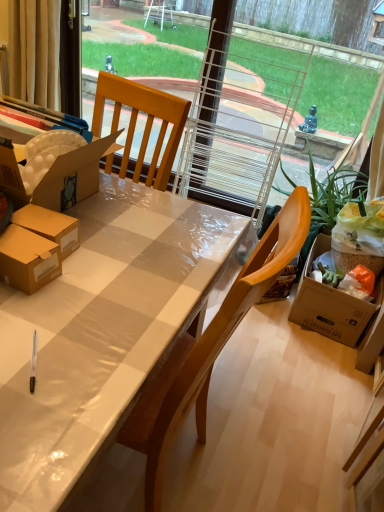
Locate an element on the screen. matte plastic desk at center is located at coordinates (101, 332).

The width and height of the screenshot is (384, 512). I want to click on beige fabric curtain at upper left, so click(34, 51).

Can green leafy plant at right be found inside beige fabric curtain at upper left?

No, green leafy plant at right is located outside of beige fabric curtain at upper left.

Consider the image. Does beige fabric curtain at upper left have a greater width compared to green leafy plant at right?

Incorrect, the width of beige fabric curtain at upper left does not surpass that of green leafy plant at right.

How different are the orientations of beige fabric curtain at upper left and green leafy plant at right in degrees?

The angle between the facing direction of beige fabric curtain at upper left and the facing direction of green leafy plant at right is 92.6 degrees.

From a real-world perspective, is beige fabric curtain at upper left positioned over green leafy plant at right based on gravity?

Indeed, from a real-world perspective, beige fabric curtain at upper left stands above green leafy plant at right.

Is beige fabric curtain at upper left facing away from matte plastic desk at center?

No, beige fabric curtain at upper left's orientation is not away from matte plastic desk at center.

Is point (41, 77) farther from camera compared to point (55, 346)?

Yes, point (41, 77) is behind point (55, 346).

Between beige fabric curtain at upper left and matte plastic desk at center, which one appears on the right side from the viewer's perspective?

matte plastic desk at center.

From the image's perspective, is matte plastic desk at center above or below green leafy plant at right?

Clearly, from the image's perspective, matte plastic desk at center is below green leafy plant at right.

Is there a large distance between matte plastic desk at center and green leafy plant at right?

Yes.

From a real-world perspective, is matte plastic desk at center located higher than green leafy plant at right?

No.

Can you confirm if matte plastic desk at center is taller than green leafy plant at right?

No, matte plastic desk at center is not taller than green leafy plant at right.

Which of these two, matte plastic desk at center or beige fabric curtain at upper left, stands taller?

matte plastic desk at center is taller.

From the image's perspective, is matte plastic desk at center above or below beige fabric curtain at upper left?

Based on their image positions, matte plastic desk at center is located beneath beige fabric curtain at upper left.

Is matte plastic desk at center facing away from beige fabric curtain at upper left?

No, beige fabric curtain at upper left is not at the back of matte plastic desk at center.

Could you tell me if green leafy plant at right is facing beige fabric curtain at upper left?

Yes, green leafy plant at right faces towards beige fabric curtain at upper left.

Is green leafy plant at right taller than beige fabric curtain at upper left?

Correct, green leafy plant at right is much taller as beige fabric curtain at upper left.

From a real-world perspective, between green leafy plant at right and beige fabric curtain at upper left, who is vertically lower?

green leafy plant at right.

Is green leafy plant at right positioned far away from beige fabric curtain at upper left?

green leafy plant at right is positioned a significant distance from beige fabric curtain at upper left.

Is green leafy plant at right facing towards matte plastic desk at center?

No.

From the image's perspective, is green leafy plant at right on matte plastic desk at center?

Yes.

Who is shorter, green leafy plant at right or matte plastic desk at center?

matte plastic desk at center.

Between green leafy plant at right and matte plastic desk at center, which one is positioned behind?

green leafy plant at right is more distant.

What are the coordinates of `houseplant in front of the beige fabric curtain at upper left` in the screenshot? It's located at coord(332,198).

Image resolution: width=384 pixels, height=512 pixels. What are the coordinates of `curtain located above the matte plastic desk at center (from a real-world perspective)` in the screenshot? It's located at (34, 51).

Based on their spatial positions, is beige fabric curtain at upper left or green leafy plant at right further from matte plastic desk at center?

beige fabric curtain at upper left is positioned further to the anchor matte plastic desk at center.

From the image, which object appears to be farther from green leafy plant at right, matte plastic desk at center or beige fabric curtain at upper left?

beige fabric curtain at upper left is positioned further to the anchor green leafy plant at right.

Looking at the image, which one is located further to matte plastic desk at center, green leafy plant at right or beige fabric curtain at upper left?

beige fabric curtain at upper left lies further to matte plastic desk at center than the other object.

Based on their spatial positions, is beige fabric curtain at upper left or matte plastic desk at center further from green leafy plant at right?

beige fabric curtain at upper left.

Looking at the image, which one is located closer to beige fabric curtain at upper left, green leafy plant at right or matte plastic desk at center?

green leafy plant at right is positioned closer to the anchor beige fabric curtain at upper left.

Based on their spatial positions, is matte plastic desk at center or green leafy plant at right further from beige fabric curtain at upper left?

matte plastic desk at center is further to beige fabric curtain at upper left.

In order to click on houseplant between matte plastic desk at center and beige fabric curtain at upper left along the z-axis in this screenshot , I will do `click(332, 198)`.